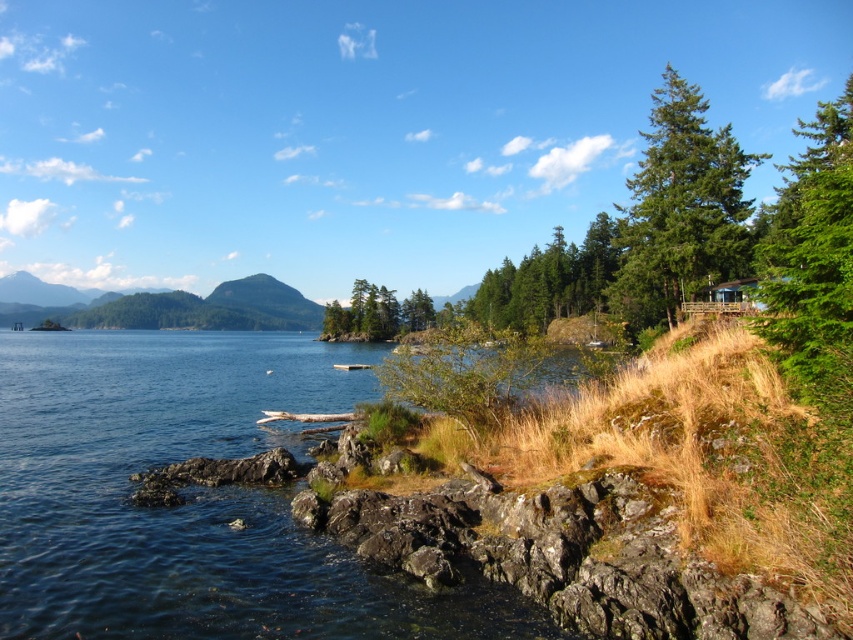
Who is positioned more to the right, green textured tree at upper right or green matte tree at center?

Positioned to the right is green textured tree at upper right.

What do you see at coordinates (680, 209) in the screenshot?
I see `green textured tree at upper right` at bounding box center [680, 209].

Which is in front, point (618, 307) or point (341, 314)?

Point (618, 307) is more forward.

Identify the location of green textured tree at upper right. The width and height of the screenshot is (853, 640). (680, 209).

Can you confirm if clear blue water at lower left is positioned to the left of green textured tree at upper right?

Correct, you'll find clear blue water at lower left to the left of green textured tree at upper right.

Does clear blue water at lower left have a greater height compared to green textured tree at upper right?

In fact, clear blue water at lower left may be shorter than green textured tree at upper right.

Describe the element at coordinates (190, 497) in the screenshot. I see `clear blue water at lower left` at that location.

The height and width of the screenshot is (640, 853). I want to click on clear blue water at lower left, so click(x=190, y=497).

Does clear blue water at lower left have a greater height compared to green matte tree at center?

In fact, clear blue water at lower left may be shorter than green matte tree at center.

Is point (18, 356) farther from camera compared to point (366, 289)?

That is False.

Measure the distance between clear blue water at lower left and camera.

clear blue water at lower left and camera are 13.60 meters apart from each other.

Identify the location of clear blue water at lower left. Image resolution: width=853 pixels, height=640 pixels. (190, 497).